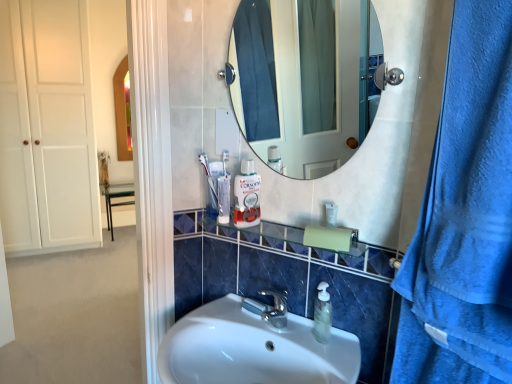
Question: Is blue textured towel at right taller than white matte closet door at left?

Choices:
 (A) yes
 (B) no

Answer: (B)

Question: From a real-world perspective, is blue textured towel at right positioned over white matte closet door at left based on gravity?

Choices:
 (A) yes
 (B) no

Answer: (B)

Question: Would you consider blue textured towel at right to be distant from white matte closet door at left?

Choices:
 (A) yes
 (B) no

Answer: (A)

Question: Could you tell me if blue textured towel at right is turned towards white matte closet door at left?

Choices:
 (A) yes
 (B) no

Answer: (B)

Question: Is the position of blue textured towel at right less distant than that of white matte closet door at left?

Choices:
 (A) yes
 (B) no

Answer: (A)

Question: From the image's perspective, is blue textured towel at right beneath white matte closet door at left?

Choices:
 (A) no
 (B) yes

Answer: (B)

Question: From the image's perspective, is blue textured towel at right on top of white glossy sink at center?

Choices:
 (A) no
 (B) yes

Answer: (B)

Question: Is blue textured towel at right further to camera compared to white glossy sink at center?

Choices:
 (A) no
 (B) yes

Answer: (A)

Question: Is blue textured towel at right positioned with its back to white glossy sink at center?

Choices:
 (A) yes
 (B) no

Answer: (B)

Question: Is blue textured towel at right bigger than white glossy sink at center?

Choices:
 (A) no
 (B) yes

Answer: (A)

Question: Could you tell me if blue textured towel at right is turned towards white glossy sink at center?

Choices:
 (A) yes
 (B) no

Answer: (B)

Question: Is white glossy sink at center inside blue textured towel at right?

Choices:
 (A) yes
 (B) no

Answer: (B)

Question: From a real-world perspective, is clear glass shelf at center positioned over white glossy sink at center based on gravity?

Choices:
 (A) no
 (B) yes

Answer: (B)